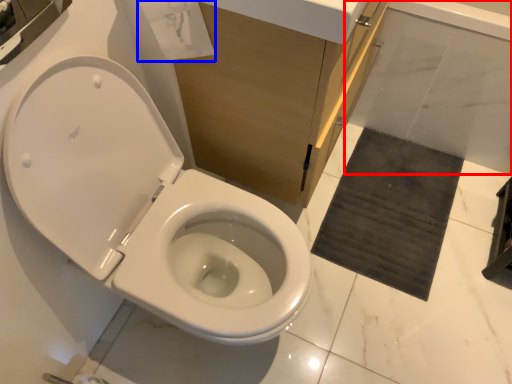
Question: Among these objects, which one is farthest to the camera, bath (highlighted by a red box) or toilet paper (highlighted by a blue box)?

Choices:
 (A) bath
 (B) toilet paper

Answer: (A)